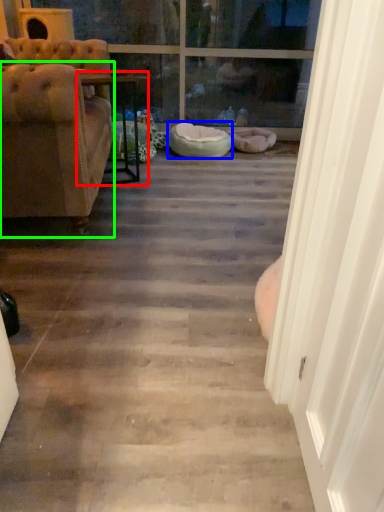
Question: Estimate the real-world distances between objects in this image. Which object is farther from table (highlighted by a red box), dog bed (highlighted by a blue box) or chair (highlighted by a green box)?

Choices:
 (A) dog bed
 (B) chair

Answer: (B)